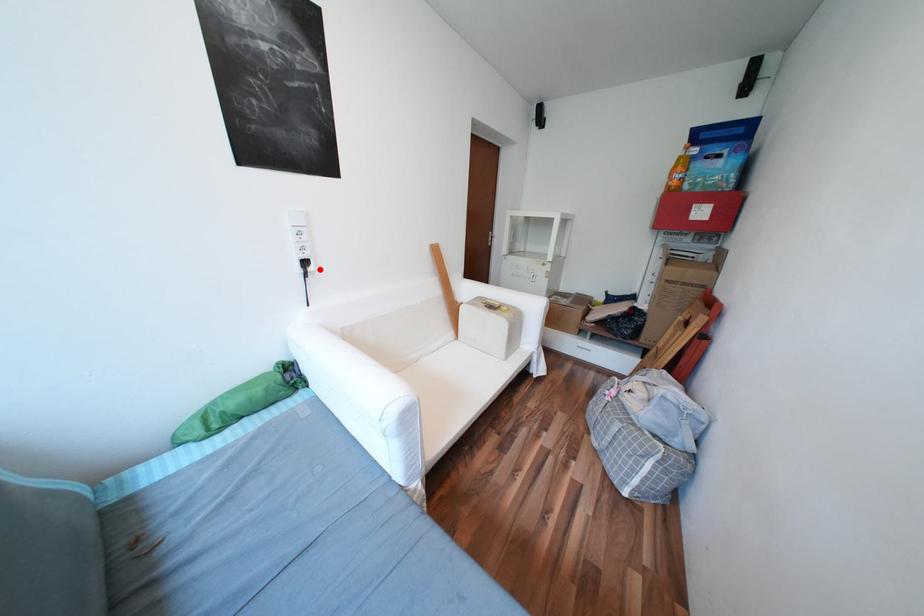
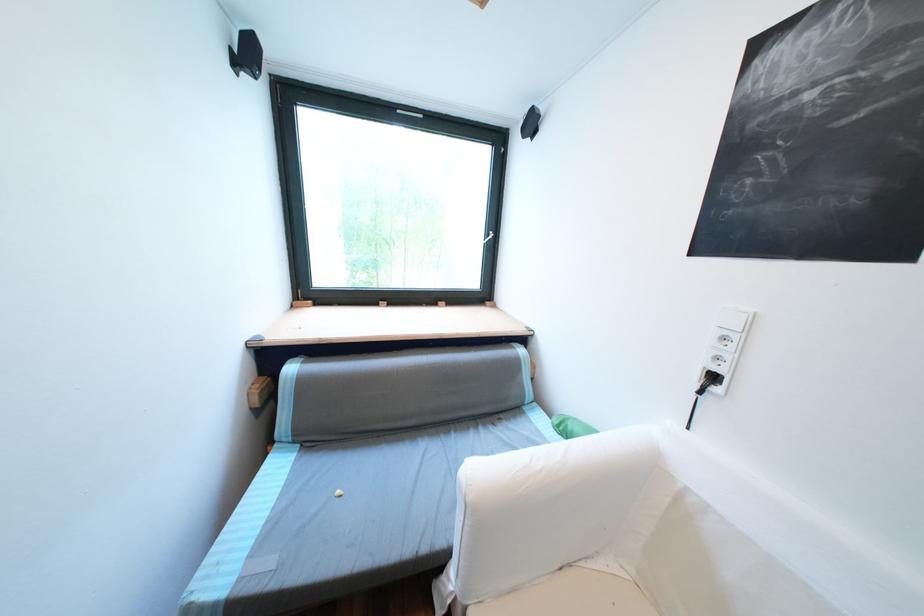
Question: I am providing you with two images of the same scene from different viewpoints. A red point is marked on the first image. At the location where the point appears in image 1, is it still visible in image 2?

Choices:
 (A) Yes
 (B) No

Answer: (A)